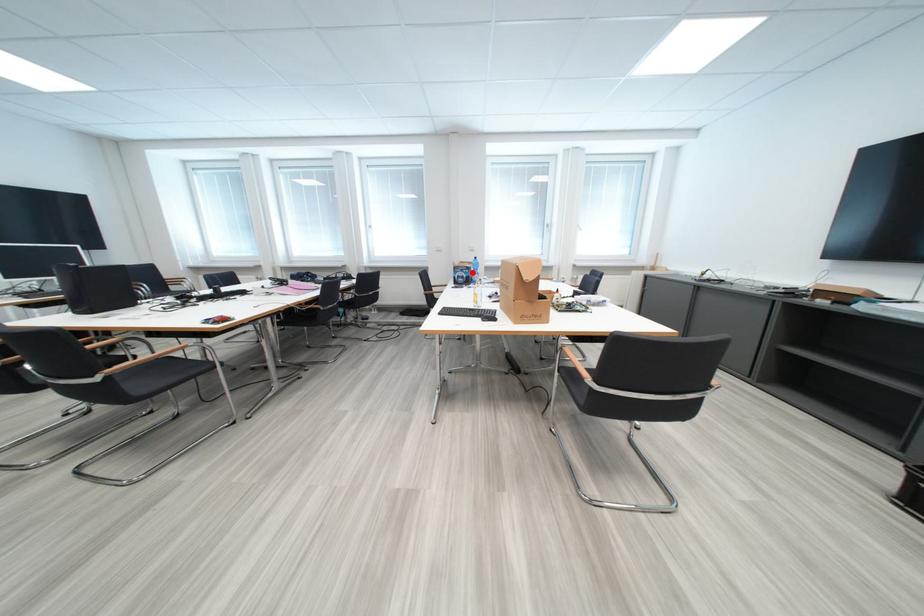
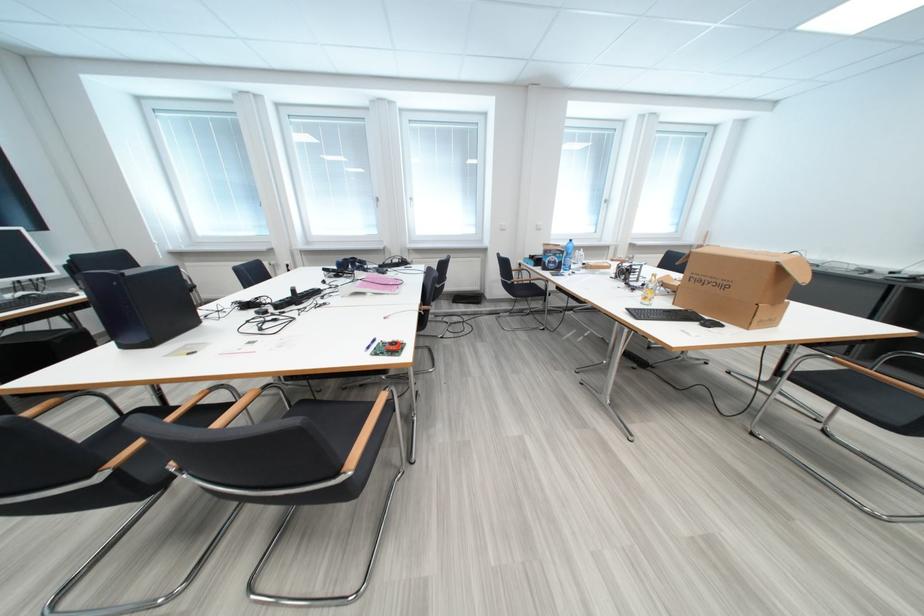
Where in the second image is the point corresponding to the highlighted location from the first image?

(565, 257)